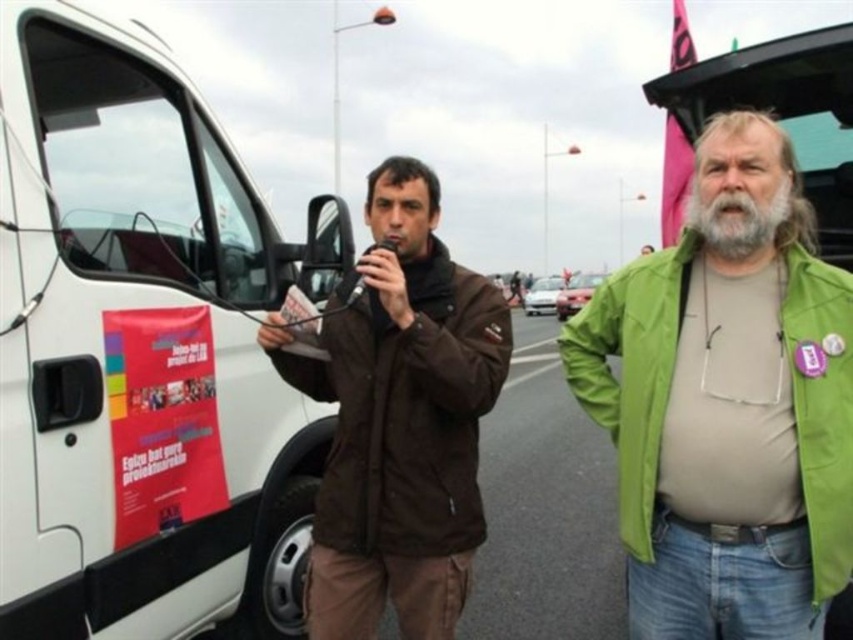
You are a delivery driver who needs to park your vehicle between the white matte van at left and the white glossy car at center. Your truck is 2 meters wide. Can you fit your truck between them?

The white matte van at left is narrower than the white glossy car at center. However, the exact distance between them isn generated from the provided information, so it is unknown if there is enough space for a 2 meter wide truck.

You are a photographer positioned to the side of the scene. You need to capture a photo that includes both the brown matte jacket at center and the metallic silver car at center. Based on their positions, which object should be placed on the left side of the photo frame to include both?

The brown matte jacket at center should be placed on the left side of the photo frame since it is to the left of the metallic silver car at center.